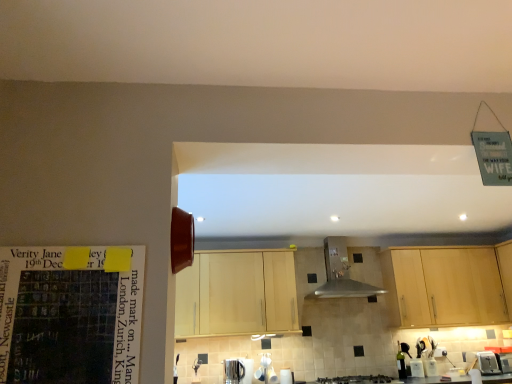
This screenshot has height=384, width=512. Describe the element at coordinates (70, 316) in the screenshot. I see `matte paper calendar at left` at that location.

The height and width of the screenshot is (384, 512). Describe the element at coordinates (448, 285) in the screenshot. I see `light wood cabinet at center, arranged as the first cabinetry when viewed from the right` at that location.

I want to click on light wood cabinet at center, arranged as the second cabinetry when viewed from the left, so click(448, 285).

What is the approximate height of light wood cabinet at center, acting as the 2th cabinetry starting from the right?

light wood cabinet at center, acting as the 2th cabinetry starting from the right, is 30.98 inches tall.

At what (x,y) coordinates should I click in order to perform the action: click on green glass bottle at lower right. Please return your answer as a coordinate pair (x, y). The height and width of the screenshot is (384, 512). Looking at the image, I should click on (401, 362).

The height and width of the screenshot is (384, 512). Find the location of `metallic stainless steel kettle at lower center, which is counted as the first appliance, starting from the left`. metallic stainless steel kettle at lower center, which is counted as the first appliance, starting from the left is located at coordinates (234, 371).

Is satin nickel faucet at lower center facing towards white glossy kettle at lower center, which appears as the 2th appliance when viewed from the left?

No, satin nickel faucet at lower center is not oriented towards white glossy kettle at lower center, which appears as the 2th appliance when viewed from the left.

Is point (192, 366) less distant than point (283, 379)?

Yes, it is in front of point (283, 379).

Is satin nickel faucet at lower center situated inside white glossy kettle at lower center, which ranks as the first appliance in right-to-left order, or outside?

satin nickel faucet at lower center cannot be found inside white glossy kettle at lower center, which ranks as the first appliance in right-to-left order.

Can we say white glossy kettle at lower center, which appears as the 2th appliance when viewed from the left, lies outside light wood cabinet at center, arranged as the second cabinetry when viewed from the left?

Indeed, white glossy kettle at lower center, which appears as the 2th appliance when viewed from the left, is completely outside light wood cabinet at center, arranged as the second cabinetry when viewed from the left.

Is white glossy kettle at lower center, which appears as the 2th appliance when viewed from the left, looking in the opposite direction of light wood cabinet at center, arranged as the first cabinetry when viewed from the right?

No, light wood cabinet at center, arranged as the first cabinetry when viewed from the right, is not at the back of white glossy kettle at lower center, which appears as the 2th appliance when viewed from the left.

Which of these two, white glossy kettle at lower center, which ranks as the first appliance in right-to-left order, or light wood cabinet at center, arranged as the second cabinetry when viewed from the left, is smaller?

white glossy kettle at lower center, which ranks as the first appliance in right-to-left order, is smaller.

Based on the photo, between white glossy kettle at lower center, which ranks as the first appliance in right-to-left order, and light wood cabinet at center, arranged as the second cabinetry when viewed from the left, which one is positioned behind?

Positioned behind is light wood cabinet at center, arranged as the second cabinetry when viewed from the left.

Is black matte gas stove at lower center situated inside light wood cabinet at center, arranged as the second cabinetry when viewed from the left, or outside?

black matte gas stove at lower center is not inside light wood cabinet at center, arranged as the second cabinetry when viewed from the left, it's outside.

From a real-world perspective, relative to light wood cabinet at center, arranged as the first cabinetry when viewed from the right, is black matte gas stove at lower center vertically above or below?

black matte gas stove at lower center is situated lower than light wood cabinet at center, arranged as the first cabinetry when viewed from the right, in the real world.

How far apart are black matte gas stove at lower center and light wood cabinet at center, arranged as the first cabinetry when viewed from the right?

black matte gas stove at lower center is 1.08 meters from light wood cabinet at center, arranged as the first cabinetry when viewed from the right.

Identify the location of cabinetry that is the 2nd one when counting upward from the black matte gas stove at lower center (from the image's perspective). The height and width of the screenshot is (384, 512). (448, 285).

Which is more to the right, satin nickel faucet at lower center or green glass bottle at lower right?

Positioned to the right is green glass bottle at lower right.

Could you tell me if satin nickel faucet at lower center is turned towards green glass bottle at lower right?

No, satin nickel faucet at lower center does not turn towards green glass bottle at lower right.

Which of these two, satin nickel faucet at lower center or green glass bottle at lower right, is wider?

Wider between the two is satin nickel faucet at lower center.

Is satin nickel faucet at lower center taller or shorter than green glass bottle at lower right?

In the image, satin nickel faucet at lower center appears to be shorter than green glass bottle at lower right.

Is the surface of green glass bottle at lower right in direct contact with light wood cabinet at center, acting as the 2th cabinetry starting from the right?

They are not placed beside each other.

Could you tell me if green glass bottle at lower right is turned towards light wood cabinet at center, acting as the 2th cabinetry starting from the right?

No, green glass bottle at lower right does not turn towards light wood cabinet at center, acting as the 2th cabinetry starting from the right.

Between green glass bottle at lower right and light wood cabinet at center, acting as the 1th cabinetry starting from the left, which one has less height?

With less height is green glass bottle at lower right.

From a real-world perspective, is green glass bottle at lower right under light wood cabinet at center, acting as the 1th cabinetry starting from the left?

Yes, from a real-world perspective, green glass bottle at lower right is beneath light wood cabinet at center, acting as the 1th cabinetry starting from the left.

Is point (405, 344) farther from camera compared to point (365, 382)?

Yes, it is.

Consider the image. Relative to black matte gas stove at lower center, is green glass bottle at lower right in front or behind?

In the image, green glass bottle at lower right appears behind black matte gas stove at lower center.

Which of these two, green glass bottle at lower right or black matte gas stove at lower center, stands taller?

green glass bottle at lower right is taller.

Can you confirm if green glass bottle at lower right is smaller than black matte gas stove at lower center?

Correct, green glass bottle at lower right occupies less space than black matte gas stove at lower center.

Does black matte gas stove at lower center come in front of satin nickel faucet at lower center?

Yes, the depth of black matte gas stove at lower center is less than that of satin nickel faucet at lower center.

Is black matte gas stove at lower center turned away from satin nickel faucet at lower center?

No, black matte gas stove at lower center is not facing away from satin nickel faucet at lower center.

Image resolution: width=512 pixels, height=384 pixels. In order to click on faucet above the white glossy kettle at lower center, which ranks as the first appliance in right-to-left order (from a real-world perspective) in this screenshot , I will do `click(196, 365)`.

The image size is (512, 384). Find the location of `cabinetry located on the right of white glossy kettle at lower center, which appears as the 2th appliance when viewed from the left`. cabinetry located on the right of white glossy kettle at lower center, which appears as the 2th appliance when viewed from the left is located at coordinates (448, 285).

When comparing their distances from light wood cabinet at center, arranged as the first cabinetry when viewed from the right, does green glass bottle at lower right or light wood cabinet at center, acting as the 2th cabinetry starting from the right, seem closer?

Among the two, green glass bottle at lower right is located nearer to light wood cabinet at center, arranged as the first cabinetry when viewed from the right.

Looking at the image, which one is located closer to metallic stainless steel kettle at lower center, which is counted as the first appliance, starting from the left, white glossy kettle at lower center, which ranks as the first appliance in right-to-left order, or matte paper calendar at left?

Among the two, white glossy kettle at lower center, which ranks as the first appliance in right-to-left order, is located nearer to metallic stainless steel kettle at lower center, which is counted as the first appliance, starting from the left.

Consider the image. Based on their spatial positions, is metallic stainless steel kettle at lower center, which is counted as the first appliance, starting from the left, or light wood cabinet at center, acting as the 1th cabinetry starting from the left, further from light wood cabinet at center, arranged as the first cabinetry when viewed from the right?

metallic stainless steel kettle at lower center, which is counted as the first appliance, starting from the left, lies further to light wood cabinet at center, arranged as the first cabinetry when viewed from the right, than the other object.

From the image, which object appears to be farther from satin nickel faucet at lower center, matte paper calendar at left or white glossy kettle at lower center, which appears as the 2th appliance when viewed from the left?

The object further to satin nickel faucet at lower center is matte paper calendar at left.

Looking at the image, which one is located further to green glass bottle at lower right, satin nickel faucet at lower center or light wood cabinet at center, acting as the 2th cabinetry starting from the right?

Based on the image, satin nickel faucet at lower center appears to be further to green glass bottle at lower right.

Considering their positions, is green glass bottle at lower right positioned further to light wood cabinet at center, arranged as the first cabinetry when viewed from the right, than satin nickel faucet at lower center?

satin nickel faucet at lower center is positioned further to the anchor light wood cabinet at center, arranged as the first cabinetry when viewed from the right.

Based on their spatial positions, is matte paper calendar at left or light wood cabinet at center, arranged as the second cabinetry when viewed from the left, further from metallic stainless steel kettle at lower center, placed as the second appliance when sorted from right to left?

Based on the image, matte paper calendar at left appears to be further to metallic stainless steel kettle at lower center, placed as the second appliance when sorted from right to left.

Based on their spatial positions, is stainless steel vent at center or green glass bottle at lower right further from light wood cabinet at center, arranged as the first cabinetry when viewed from the right?

green glass bottle at lower right is positioned further to the anchor light wood cabinet at center, arranged as the first cabinetry when viewed from the right.

In order to click on cabinetry between metallic stainless steel kettle at lower center, placed as the second appliance when sorted from right to left, and black matte gas stove at lower center from left to right in this screenshot , I will do `click(237, 294)`.

Locate an element on the screen. The image size is (512, 384). appliance between light wood cabinet at center, acting as the 2th cabinetry starting from the right, and stainless steel vent at center from left to right is located at coordinates (286, 376).

You are a GUI agent. You are given a task and a screenshot of the screen. Output one action in this format:
    pyautogui.click(x=<x>, y=<y>)
    Task: Click on the cabinetry between satin nickel faucet at lower center and stainless steel vent at center
    The width and height of the screenshot is (512, 384).
    Given the screenshot: What is the action you would take?
    pyautogui.click(x=237, y=294)

Locate an element on the screen. The image size is (512, 384). gas stove situated between metallic stainless steel kettle at lower center, which is counted as the first appliance, starting from the left, and light wood cabinet at center, arranged as the first cabinetry when viewed from the right, from left to right is located at coordinates (356, 379).